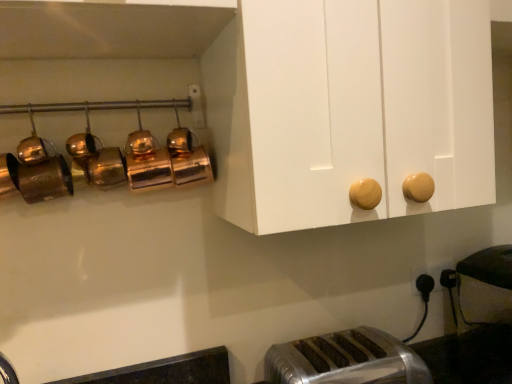
Question: From a real-world perspective, is silver metallic toaster at lower center positioned above or below black plastic outlet at lower right?

Choices:
 (A) above
 (B) below

Answer: (B)

Question: Considering their positions, is silver metallic toaster at lower center located in front of or behind black plastic outlet at lower right?

Choices:
 (A) front
 (B) behind

Answer: (A)

Question: Considering the positions of silver metallic toaster at lower center and black plastic outlet at lower right in the image, is silver metallic toaster at lower center taller or shorter than black plastic outlet at lower right?

Choices:
 (A) tall
 (B) short

Answer: (A)

Question: Is black plastic outlet at lower right bigger or smaller than silver metallic toaster at lower center?

Choices:
 (A) big
 (B) small

Answer: (B)

Question: Is black plastic outlet at lower right situated inside silver metallic toaster at lower center or outside?

Choices:
 (A) inside
 (B) outside

Answer: (B)

Question: Looking at their shapes, would you say black plastic outlet at lower right is wider or thinner than silver metallic toaster at lower center?

Choices:
 (A) wide
 (B) thin

Answer: (B)

Question: In the image, is black plastic outlet at lower right positioned in front of or behind silver metallic toaster at lower center?

Choices:
 (A) front
 (B) behind

Answer: (B)